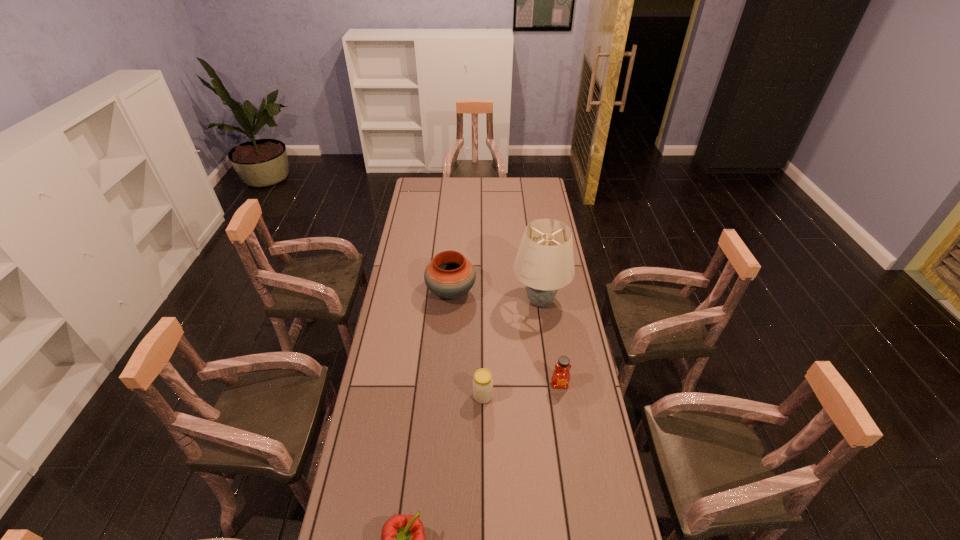
You are a GUI agent. You are given a task and a screenshot of the screen. Output one action in this format:
    pyautogui.click(x=<x>, y=<y>)
    Task: Click on the vacant space that satisfies the following two spatial constraints: 1. on the back side of the tallest object; 2. on the left side of the jar
    The image size is (960, 540).
    Given the screenshot: What is the action you would take?
    pyautogui.click(x=482, y=302)